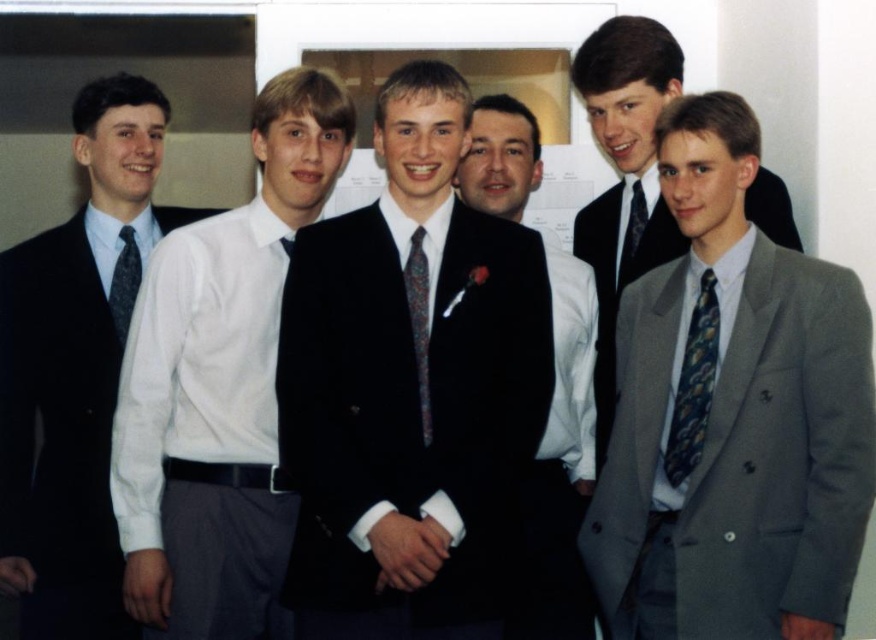
You are taking a photo of two points in the image. The first point is labeled as point (641, 458) and the second is point (140, 132). If you want to focus on the point that is closer to you, which coordinate should you adjust your camera to focus on?

Point (641, 458) is closer to the camera than point (140, 132), so you should focus on point (641, 458).

You are a photographer taking a group photo of the men in the scene. You need to ensure that both the shiny black suit at center and the black velvet suit at center are visible in the frame. Based on their positions, which one should you focus on first to capture both in the shot?

The shiny black suit at center is located below the black velvet suit at center. To capture both in the frame, focus on the black velvet suit at center first as it is higher up, ensuring the lower shiny black suit at center remains within the shot.